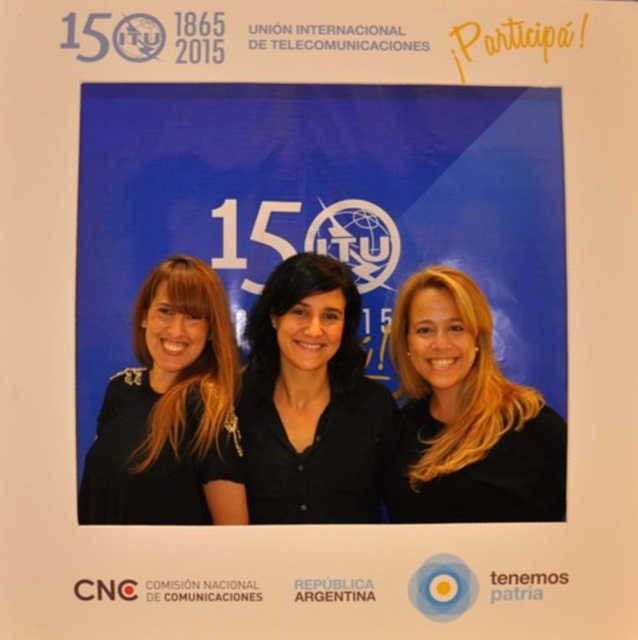
You are a photographer at the event and want to ensure that the black matte shirt at center and the blonde hair at center are both visible in your photo. Which object should you focus on to ensure the thinner one is sharp?

The black matte shirt at center is thinner than the blonde hair at center, so you should focus on the black matte shirt at center to ensure the thinner one is sharp.

You are a photographer who wants to focus on the blonde hair at center. Where should you aim your camera?

The blonde hair at center is located at point 0.650 on the x axis and 0.732 on the y axis. Aim your camera there.

You are a photographer at the event and need to adjust the lighting so that the black matte shirt at center and the blonde hair at center are both visible. Which object should you focus on first to ensure proper exposure?

The black matte shirt at center is positioned on the left side of blonde hair at center. Since the black shirt absorbs more light, you should focus on exposing for the black matte shirt at center first to prevent it from becoming too dark.